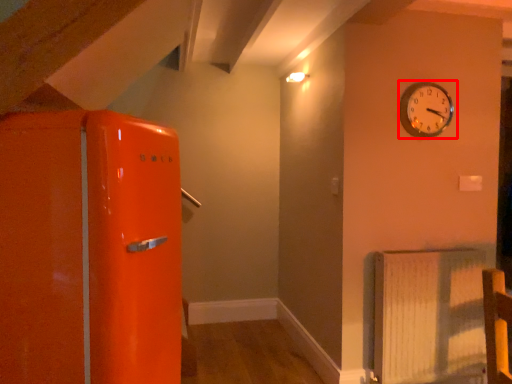
Question: Observing the image, what is the correct spatial positioning of wall clock (annotated by the red box) in reference to radiator?

Choices:
 (A) left
 (B) right

Answer: (A)